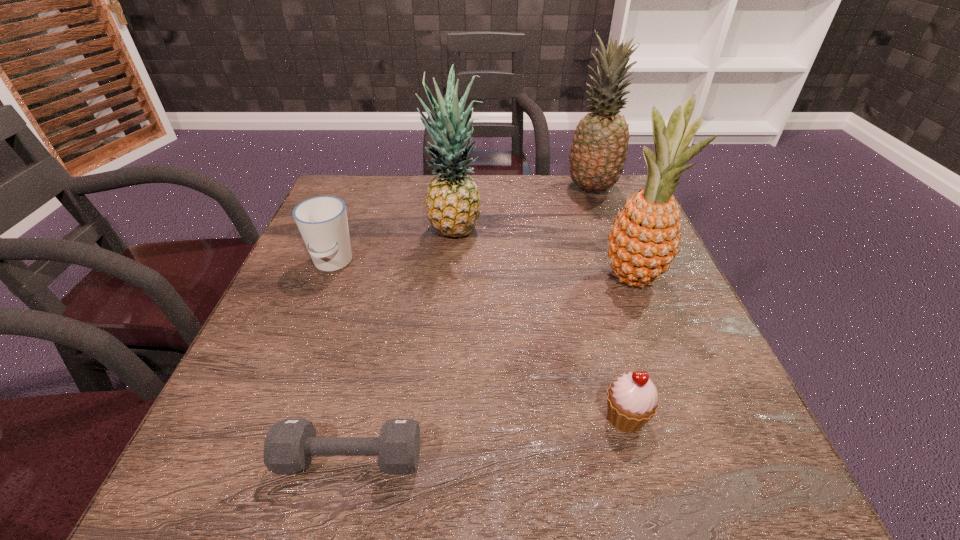
Image resolution: width=960 pixels, height=540 pixels. I want to click on vacant space positioned on the left of the cupcake, so click(x=502, y=417).

Locate an element on the screen. free space located 0.110m on the left of the shortest object is located at coordinates (207, 457).

Locate an element on the screen. This screenshot has height=540, width=960. object located at the near edge is located at coordinates (290, 444).

Where is `cup at the left edge`? The height and width of the screenshot is (540, 960). cup at the left edge is located at coordinates (322, 221).

Where is `dumbbell located in the left edge section of the desktop`? Image resolution: width=960 pixels, height=540 pixels. dumbbell located in the left edge section of the desktop is located at coordinates (290, 444).

Where is `cupcake present at the right edge`? Image resolution: width=960 pixels, height=540 pixels. cupcake present at the right edge is located at coordinates (632, 399).

Find the location of a particular element. This screenshot has width=960, height=540. object at the near left corner is located at coordinates (290, 444).

The image size is (960, 540). Find the location of `object present at the far right corner`. object present at the far right corner is located at coordinates (599, 149).

You are a GUI agent. You are given a task and a screenshot of the screen. Output one action in this format:
    pyautogui.click(x=<x>, y=<y>)
    Task: Click on the blank space at the far edge of the desktop
    Image resolution: width=960 pixels, height=540 pixels.
    Given the screenshot: What is the action you would take?
    pyautogui.click(x=570, y=194)

This screenshot has height=540, width=960. Find the location of `blank area at the near edge`. blank area at the near edge is located at coordinates (562, 454).